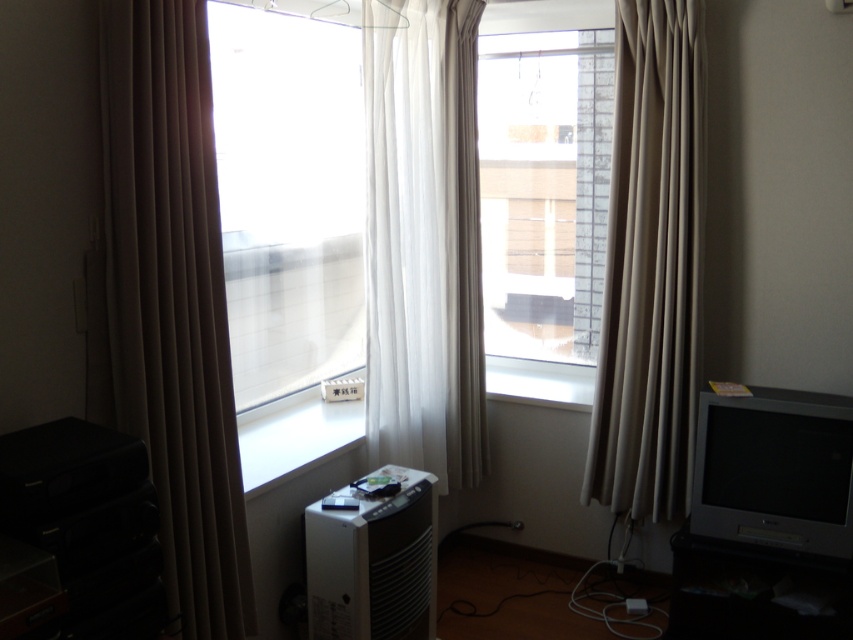
Can you confirm if transparent plastic window at center is positioned to the right of transparent glass window at center?

No, transparent plastic window at center is not to the right of transparent glass window at center.

Between transparent plastic window at center and transparent glass window at center, which one is positioned lower?

transparent plastic window at center is lower down.

Which is behind, point (270, 240) or point (602, 131)?

Positioned behind is point (602, 131).

Locate an element on the screen. transparent plastic window at center is located at coordinates (288, 196).

Is beige fabric curtain at left in front of transparent glass window at center?

Yes, it is in front of transparent glass window at center.

Is beige fabric curtain at left to the left of transparent glass window at center from the viewer's perspective?

Yes, beige fabric curtain at left is to the left of transparent glass window at center.

The image size is (853, 640). Describe the element at coordinates (173, 304) in the screenshot. I see `beige fabric curtain at left` at that location.

You are a GUI agent. You are given a task and a screenshot of the screen. Output one action in this format:
    pyautogui.click(x=<x>, y=<y>)
    Task: Click on the beige fabric curtain at left
    This screenshot has width=853, height=640.
    Given the screenshot: What is the action you would take?
    pyautogui.click(x=173, y=304)

Can you confirm if white sheer curtain at center is smaller than beige fabric curtain at right?

No.

Between white sheer curtain at center and beige fabric curtain at right, which one has more height?

With more height is white sheer curtain at center.

Find the location of `white sheer curtain at center`. white sheer curtain at center is located at coordinates (422, 237).

The image size is (853, 640). I want to click on white sheer curtain at center, so click(422, 237).